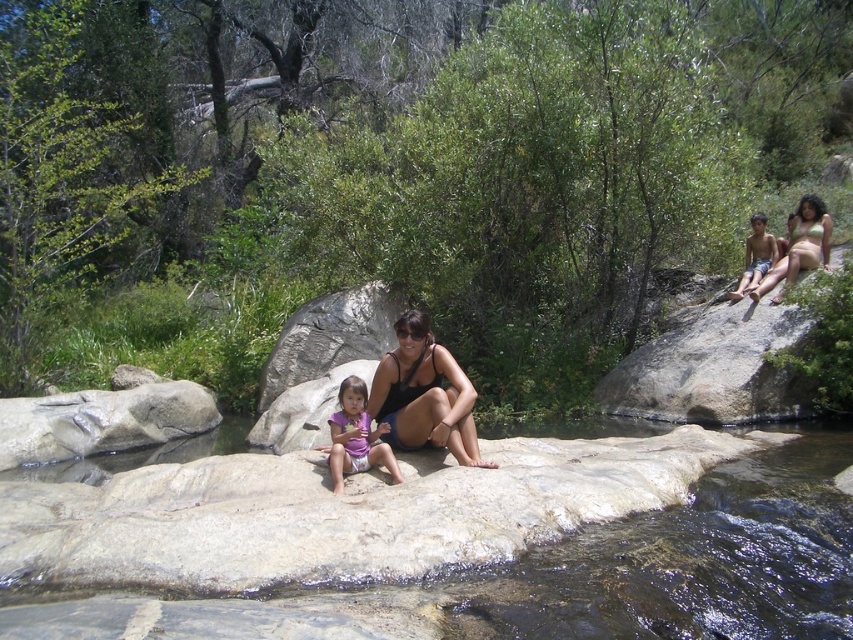
Question: Which object is closer to the camera taking this photo?

Choices:
 (A) matte black bikini at center
 (B) purple fabric at center

Answer: (B)

Question: Which object is closer to the camera taking this photo?

Choices:
 (A) purple fabric at center
 (B) matte black swimsuit at center

Answer: (A)

Question: Where is clear water at rock center located in relation to light brown skin at upper right in the image?

Choices:
 (A) right
 (B) left

Answer: (B)

Question: Is light brown skin at upper right positioned behind matte black bikini top at upper right?

Choices:
 (A) no
 (B) yes

Answer: (A)

Question: Which point is farther to the camera?

Choices:
 (A) (762, 248)
 (B) (463, 397)

Answer: (A)

Question: Does purple fabric at center have a larger size compared to light brown skin at upper right?

Choices:
 (A) no
 (B) yes

Answer: (A)